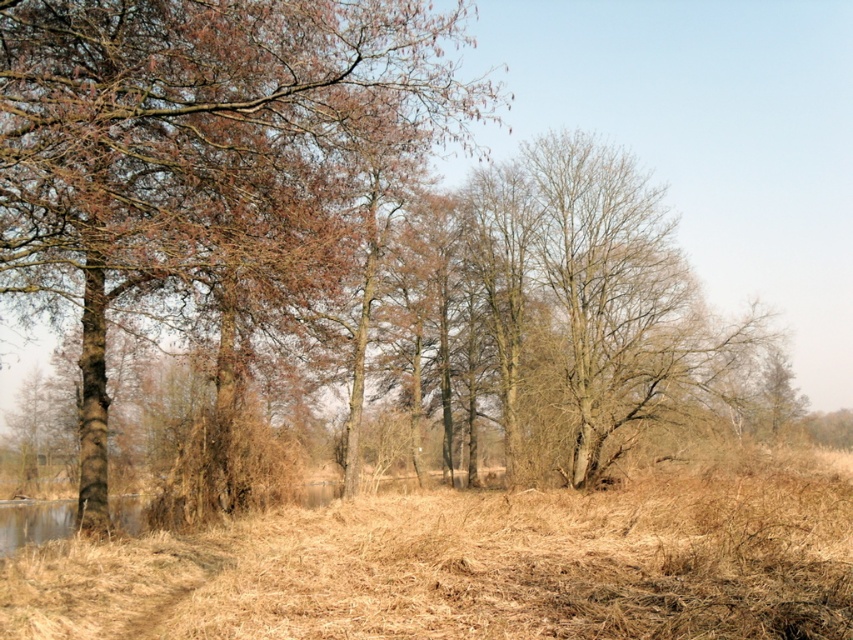
Question: Can you confirm if brown bark tree at left is thinner than brown dry grass at center?

Choices:
 (A) no
 (B) yes

Answer: (B)

Question: Among these objects, which one is nearest to the camera?

Choices:
 (A) brown bark tree at left
 (B) brown dry grass at center

Answer: (B)

Question: Which of the following is the closest to the observer?

Choices:
 (A) brown bark tree at left
 (B) brown dry grass at center

Answer: (B)

Question: Does brown bark tree at left lie in front of brown dry grass at center?

Choices:
 (A) yes
 (B) no

Answer: (B)

Question: Is brown bark tree at left smaller than brown dry grass at center?

Choices:
 (A) yes
 (B) no

Answer: (B)